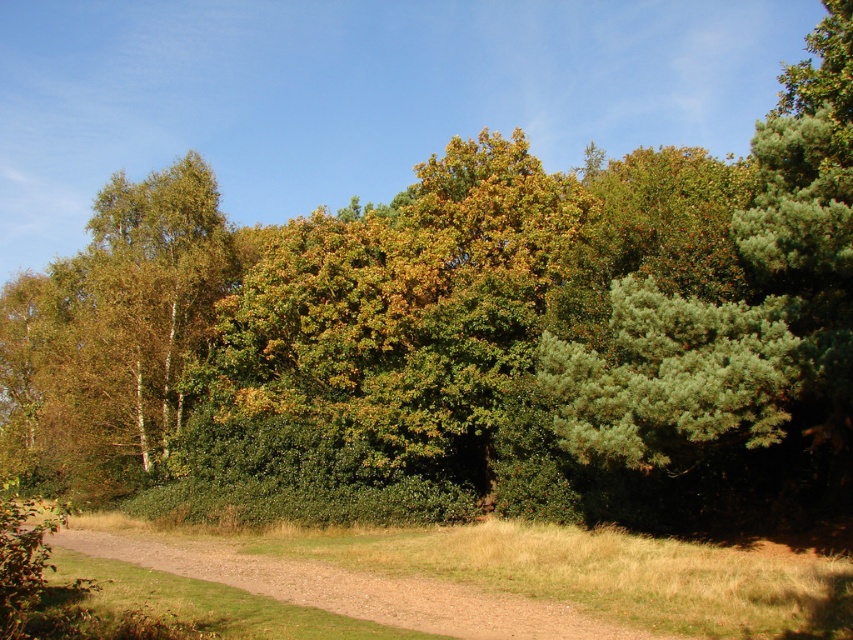
Is green leafy tree at center to the right of brown gravel path at lower center from the viewer's perspective?

Yes, green leafy tree at center is to the right of brown gravel path at lower center.

Can you confirm if green leafy tree at center is wider than brown gravel path at lower center?

Yes, green leafy tree at center is wider than brown gravel path at lower center.

The height and width of the screenshot is (640, 853). Identify the location of green leafy tree at center. (407, 308).

You are a GUI agent. You are given a task and a screenshot of the screen. Output one action in this format:
    pyautogui.click(x=<x>, y=<y>)
    Task: Click on the green leafy tree at center
    This screenshot has height=640, width=853.
    Given the screenshot: What is the action you would take?
    pyautogui.click(x=407, y=308)

Is green leafy tree at center wider than green leafy tree at left?

No.

Does green leafy tree at center appear over green leafy tree at left?

Incorrect, green leafy tree at center is not positioned above green leafy tree at left.

Is point (422, 227) farther from camera compared to point (7, 456)?

No, (422, 227) is closer to viewer.

What are the coordinates of `green leafy tree at center` in the screenshot? It's located at [x=407, y=308].

Is green leafy tree at left smaller than brown gravel path at lower center?

Actually, green leafy tree at left might be larger than brown gravel path at lower center.

Does green leafy tree at left have a greater width compared to brown gravel path at lower center?

Indeed, green leafy tree at left has a greater width compared to brown gravel path at lower center.

Does point (161, 394) come closer to viewer compared to point (201, 570)?

No, it is not.

Locate an element on the screen. green leafy tree at left is located at coordinates (113, 337).